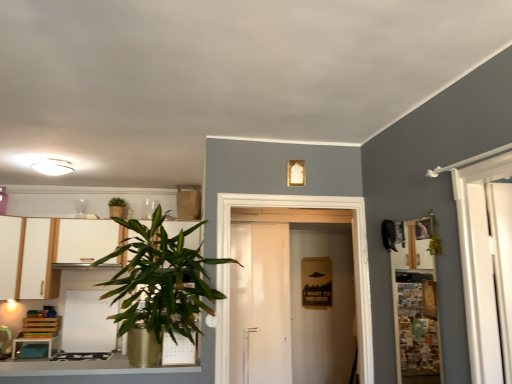
Question: Should I look upward or downward to see white matte door at center?

Choices:
 (A) up
 (B) down

Answer: (B)

Question: Does wooden/matte shelf at right have a larger size compared to green leafy plant at left, which is the first houseplant in right-to-left order?

Choices:
 (A) yes
 (B) no

Answer: (B)

Question: From the image's perspective, is wooden/matte shelf at right above green leafy plant at left, the 1th houseplant viewed from the front?

Choices:
 (A) yes
 (B) no

Answer: (B)

Question: Is wooden/matte shelf at right closer to the viewer compared to green leafy plant at left, the 1th houseplant viewed from the front?

Choices:
 (A) no
 (B) yes

Answer: (B)

Question: Considering the relative positions of wooden/matte shelf at right and green leafy plant at left, the 2th houseplant positioned from the left, in the image provided, is wooden/matte shelf at right to the left of green leafy plant at left, the 2th houseplant positioned from the left, from the viewer's perspective?

Choices:
 (A) no
 (B) yes

Answer: (A)

Question: Is wooden/matte shelf at right far from green leafy plant at left, the 2th houseplant positioned from the left?

Choices:
 (A) no
 (B) yes

Answer: (B)

Question: Does wooden/matte shelf at right have a greater height compared to green leafy plant at left, which is the first houseplant in right-to-left order?

Choices:
 (A) yes
 (B) no

Answer: (B)

Question: Is green leafy plant at upper left, the 2th houseplant viewed from the right, at the back of white glossy stove at lower left?

Choices:
 (A) yes
 (B) no

Answer: (B)

Question: Is white glossy stove at lower left not inside green leafy plant at upper left, the 2th houseplant viewed from the right?

Choices:
 (A) yes
 (B) no

Answer: (A)

Question: Can you confirm if white glossy stove at lower left is thinner than green leafy plant at upper left, arranged as the 2th houseplant when viewed from the front?

Choices:
 (A) yes
 (B) no

Answer: (A)

Question: From a real-world perspective, does white glossy stove at lower left sit lower than green leafy plant at upper left, the 1th houseplant in the left-to-right sequence?

Choices:
 (A) no
 (B) yes

Answer: (B)

Question: Is white glossy stove at lower left taller than green leafy plant at upper left, the first houseplant from the back?

Choices:
 (A) yes
 (B) no

Answer: (A)

Question: Considering the relative sizes of white glossy stove at lower left and green leafy plant at upper left, arranged as the 2th houseplant when viewed from the front, in the image provided, is white glossy stove at lower left bigger than green leafy plant at upper left, arranged as the 2th houseplant when viewed from the front,?

Choices:
 (A) yes
 (B) no

Answer: (A)

Question: Considering the relative sizes of white matte cabinet at left, which appears as the first cabinetry when viewed from the right, and white glossy stove at lower left in the image provided, is white matte cabinet at left, which appears as the first cabinetry when viewed from the right, taller than white glossy stove at lower left?

Choices:
 (A) no
 (B) yes

Answer: (B)